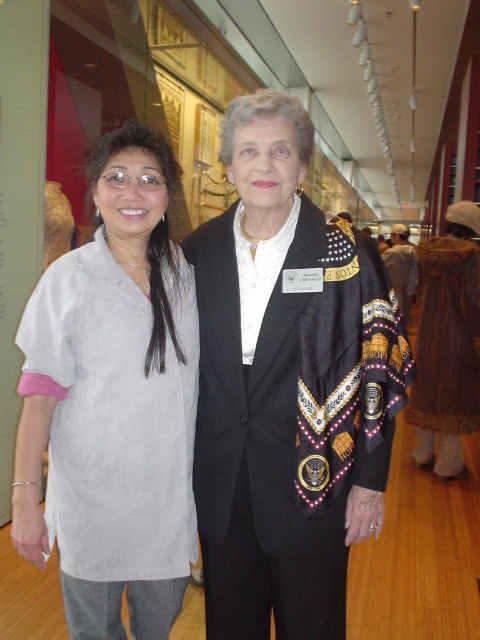
What is the 2D coordinate of the black satin jacket at center?

The 2D coordinate of the black satin jacket at center is at point (x=288, y=387).

You are a photographer setting up for an event. You need to adjust the lighting to ensure both the black satin jacket at center and the light gray fabric shirt at left are well illuminated. Based on their positions, which clothing item is higher up and might need more upward lighting adjustment?

The black satin jacket at center is above the light gray fabric shirt at left, so it is higher up and may require more upward lighting adjustments to ensure proper illumination.